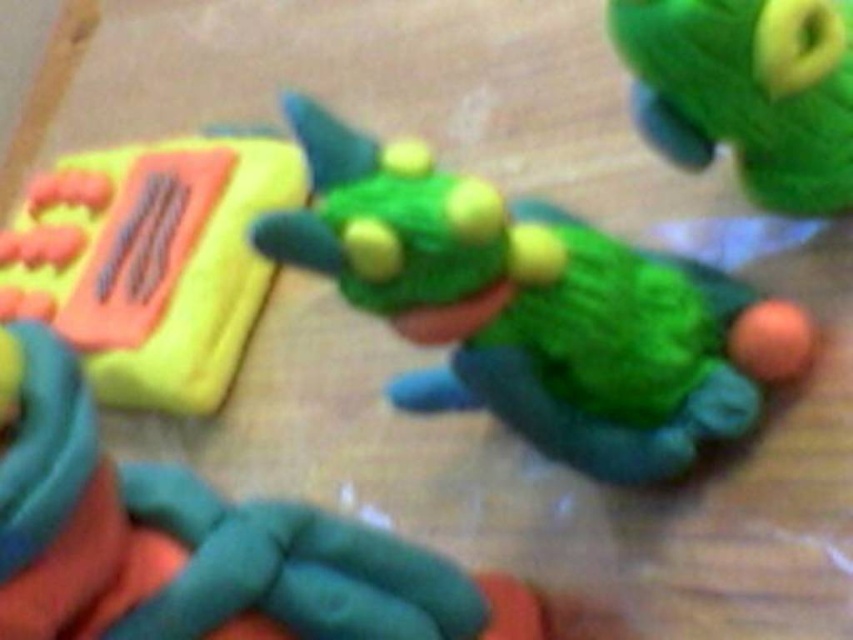
Question: From the image, what is the correct spatial relationship of green clay dragon at center in relation to yellow matte phone at left?

Choices:
 (A) above
 (B) below

Answer: (B)

Question: Does matte green clay turtle at center have a lesser width compared to green fuzzy turtle at upper right?

Choices:
 (A) no
 (B) yes

Answer: (A)

Question: Which of the following is the closest to the observer?

Choices:
 (A) (280, 547)
 (B) (502, 252)

Answer: (B)

Question: Which of the following is the farthest from the observer?

Choices:
 (A) matte green clay turtle at center
 (B) yellow matte phone at left

Answer: (B)

Question: Is matte green clay turtle at center in front of green fuzzy turtle at upper right?

Choices:
 (A) yes
 (B) no

Answer: (A)

Question: Which point is closer to the camera?

Choices:
 (A) yellow matte phone at left
 (B) green fuzzy turtle at upper right

Answer: (B)